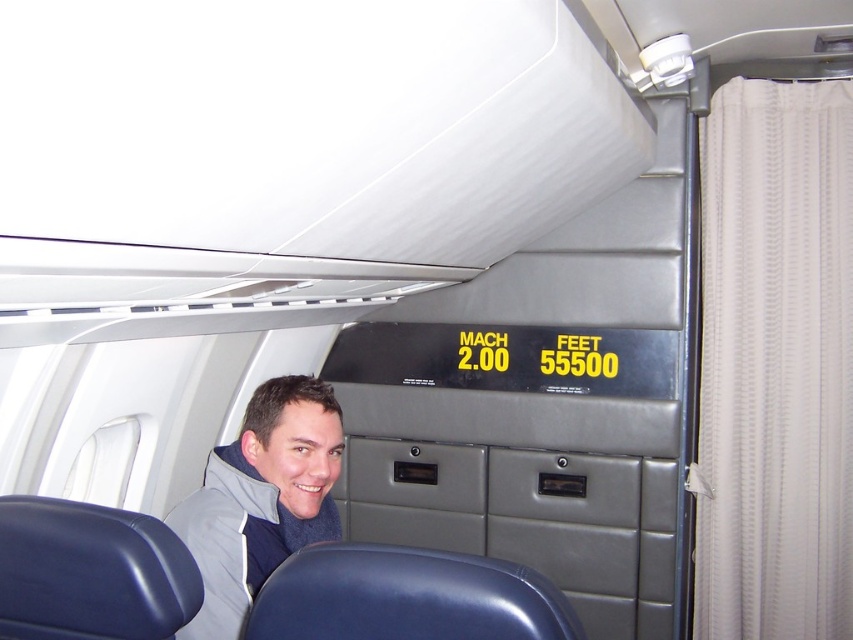
In the scene shown: Can you confirm if gray fleece jacket at lower left is smaller than blue leather seat at lower center?

No.

Is gray fleece jacket at lower left taller than blue leather seat at lower center?

Yes.

In order to click on gray fleece jacket at lower left in this screenshot , I will do `click(260, 499)`.